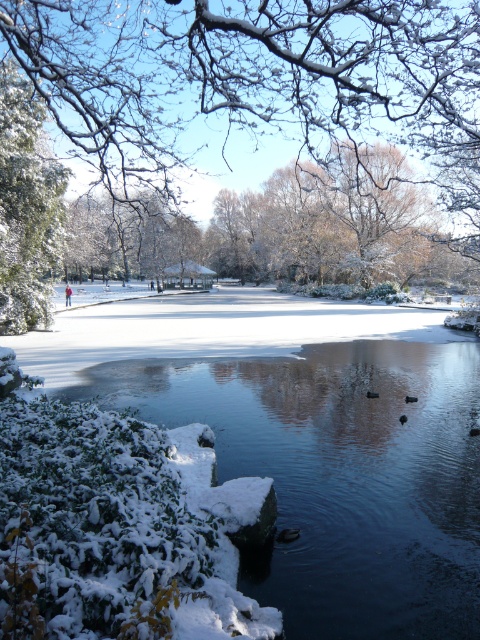
Can you confirm if snow-covered branches at upper center is bigger than green matte tree at upper left?

Yes.

Measure the distance between snow-covered branches at upper center and camera.

snow-covered branches at upper center is 5.77 meters from camera.

Find the location of a particular element. snow-covered branches at upper center is located at coordinates (256, 76).